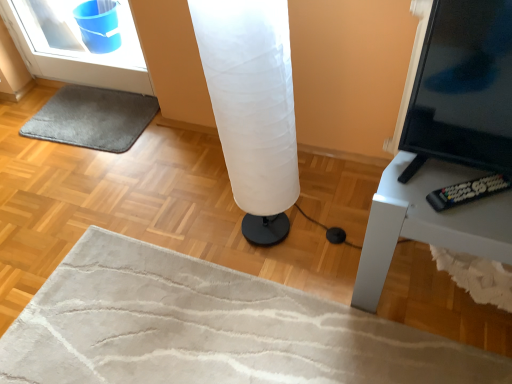
Question: Considering the relative sizes of gray soft rug at lower left and white fabric lamp at center in the image provided, is gray soft rug at lower left thinner than white fabric lamp at center?

Choices:
 (A) yes
 (B) no

Answer: (B)

Question: Could you tell me if gray soft rug at lower left is turned towards white fabric lamp at center?

Choices:
 (A) no
 (B) yes

Answer: (A)

Question: Can we say gray soft rug at lower left lies outside white fabric lamp at center?

Choices:
 (A) yes
 (B) no

Answer: (A)

Question: Does gray soft rug at lower left have a greater width compared to white fabric lamp at center?

Choices:
 (A) yes
 (B) no

Answer: (A)

Question: From a real-world perspective, is gray soft rug at lower left physically above white fabric lamp at center?

Choices:
 (A) no
 (B) yes

Answer: (A)

Question: From a real-world perspective, relative to gray soft rug at lower left, is white fabric lamp at center vertically above or below?

Choices:
 (A) below
 (B) above

Answer: (B)

Question: Is white fabric lamp at center wider or thinner than gray soft rug at lower left?

Choices:
 (A) thin
 (B) wide

Answer: (A)

Question: Is white fabric lamp at center in front of or behind gray soft rug at lower left in the image?

Choices:
 (A) behind
 (B) front

Answer: (B)

Question: Is point (254, 157) positioned closer to the camera than point (96, 120)?

Choices:
 (A) farther
 (B) closer

Answer: (B)

Question: Is point (466, 99) closer or farther from the camera than point (75, 125)?

Choices:
 (A) farther
 (B) closer

Answer: (B)

Question: From a real-world perspective, is black glossy screen at right positioned above or below gray soft rug at lower left?

Choices:
 (A) below
 (B) above

Answer: (B)

Question: Relative to gray soft rug at lower left, is black glossy screen at right in front or behind?

Choices:
 (A) front
 (B) behind

Answer: (A)

Question: From the image's perspective, is black glossy screen at right positioned above or below gray soft rug at lower left?

Choices:
 (A) above
 (B) below

Answer: (B)

Question: In the image, is gray soft rug at lower left positioned in front of or behind black glossy screen at right?

Choices:
 (A) front
 (B) behind

Answer: (B)

Question: In terms of size, does gray soft rug at lower left appear bigger or smaller than black glossy screen at right?

Choices:
 (A) small
 (B) big

Answer: (A)